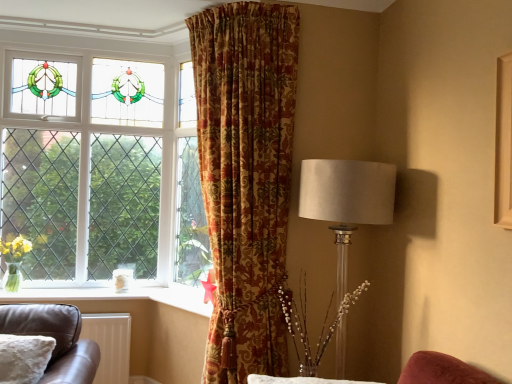
Question: Looking at the image, does translucent glass vase with yellow flowers at left, arranged as the 1th floral arrangement when viewed from the back, seem bigger or smaller compared to translucent glass vase at center, placed as the 1th floral arrangement when sorted from right to left?

Choices:
 (A) small
 (B) big

Answer: (A)

Question: Is point (15, 276) closer or farther from the camera than point (323, 336)?

Choices:
 (A) farther
 (B) closer

Answer: (A)

Question: Estimate the real-world distances between objects in this image. Which object is closer to the translucent glass vase with yellow flowers at left, which is the 2th floral arrangement from right to left?

Choices:
 (A) white matte radiator at lower left
 (B) gold-patterned curtain at center
 (C) clear glass window at upper left
 (D) satin white lampshade at right
 (E) white fluffy pillow at lower left

Answer: (A)

Question: Considering the real-world distances, which object is closest to the translucent glass vase at center, the 2th floral arrangement from the back?

Choices:
 (A) white fluffy pillow at lower left
 (B) translucent glass vase with yellow flowers at left, which is the 2th floral arrangement from right to left
 (C) white matte radiator at lower left
 (D) gold-patterned curtain at center
 (E) clear glass window at upper left

Answer: (D)